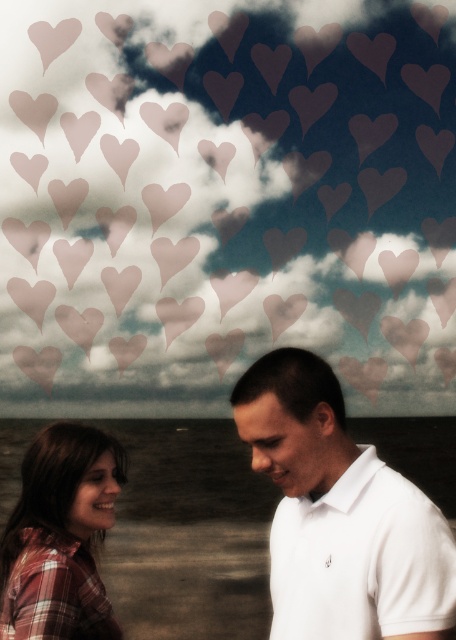
Question: Does white cotton polo shirt at center have a greater width compared to plaid fabric shirt at lower left?

Choices:
 (A) yes
 (B) no

Answer: (A)

Question: Does white cotton polo shirt at center have a larger size compared to plaid fabric shirt at lower left?

Choices:
 (A) yes
 (B) no

Answer: (B)

Question: Does white cotton polo shirt at center have a smaller size compared to plaid fabric shirt at lower left?

Choices:
 (A) yes
 (B) no

Answer: (A)

Question: Which point is closer to the camera taking this photo?

Choices:
 (A) (327, 420)
 (B) (77, 470)

Answer: (A)

Question: Which point is closer to the camera?

Choices:
 (A) plaid fabric shirt at lower left
 (B) white cotton polo shirt at center

Answer: (B)